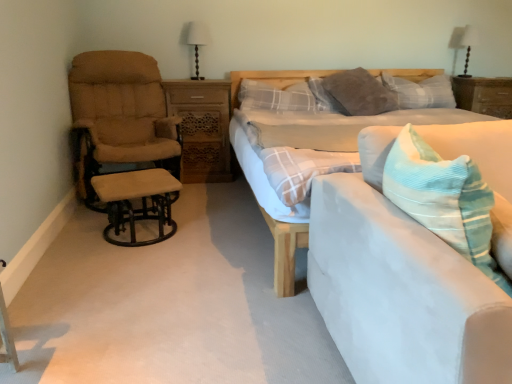
Question: Is light blue fabric bed at center completely or partially inside white fabric lampshade at upper right, which ranks as the 1th table lamp in back-to-front order?

Choices:
 (A) yes
 (B) no

Answer: (B)

Question: From the image's perspective, would you say white fabric lampshade at upper right, which appears as the first table lamp when viewed from the right, is positioned over light blue fabric bed at center?

Choices:
 (A) no
 (B) yes

Answer: (B)

Question: Considering the relative sizes of white fabric lampshade at upper right, the 2th table lamp when ordered from left to right, and light blue fabric bed at center in the image provided, is white fabric lampshade at upper right, the 2th table lamp when ordered from left to right, smaller than light blue fabric bed at center?

Choices:
 (A) no
 (B) yes

Answer: (B)

Question: Is light blue fabric bed at center at the back of white fabric lampshade at upper right, which appears as the first table lamp when viewed from the right?

Choices:
 (A) no
 (B) yes

Answer: (A)

Question: Is white fabric lampshade at upper right, which appears as the first table lamp when viewed from the right, shorter than light blue fabric bed at center?

Choices:
 (A) no
 (B) yes

Answer: (B)

Question: Is white fabric lampshade at upper right, which appears as the first table lamp when viewed from the right, placed right next to light blue fabric bed at center?

Choices:
 (A) yes
 (B) no

Answer: (B)

Question: Is plaid fabric pillow at center, the first pillow when ordered from left to right, shorter than light blue fabric couch at right?

Choices:
 (A) yes
 (B) no

Answer: (A)

Question: Is plaid fabric pillow at center, the first pillow when ordered from left to right, closer to camera compared to light blue fabric couch at right?

Choices:
 (A) yes
 (B) no

Answer: (B)

Question: Is plaid fabric pillow at center, which is the third pillow from right to left, facing towards light blue fabric couch at right?

Choices:
 (A) no
 (B) yes

Answer: (B)

Question: From the image's perspective, is plaid fabric pillow at center, which is the third pillow from right to left, beneath light blue fabric couch at right?

Choices:
 (A) no
 (B) yes

Answer: (A)

Question: Considering the relative sizes of plaid fabric pillow at center, which is the third pillow from right to left, and light blue fabric couch at right in the image provided, is plaid fabric pillow at center, which is the third pillow from right to left, thinner than light blue fabric couch at right?

Choices:
 (A) no
 (B) yes

Answer: (B)

Question: Does plaid fabric pillow at center, the first pillow when ordered from left to right, lie behind light blue fabric couch at right?

Choices:
 (A) no
 (B) yes

Answer: (B)

Question: From a real-world perspective, does beige fabric stool at left stand above wooden nightstand at right, the first nightstand positioned from the right?

Choices:
 (A) yes
 (B) no

Answer: (B)